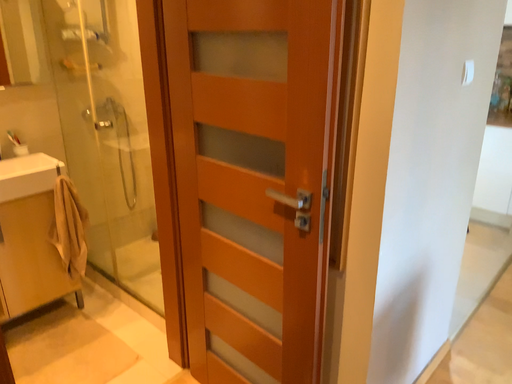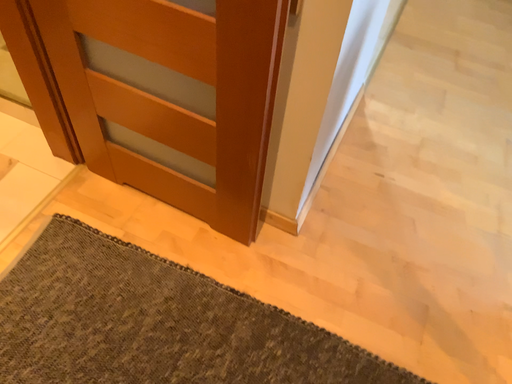
Question: How did the camera likely rotate when shooting the video?

Choices:
 (A) rotated downward
 (B) rotated upward

Answer: (A)